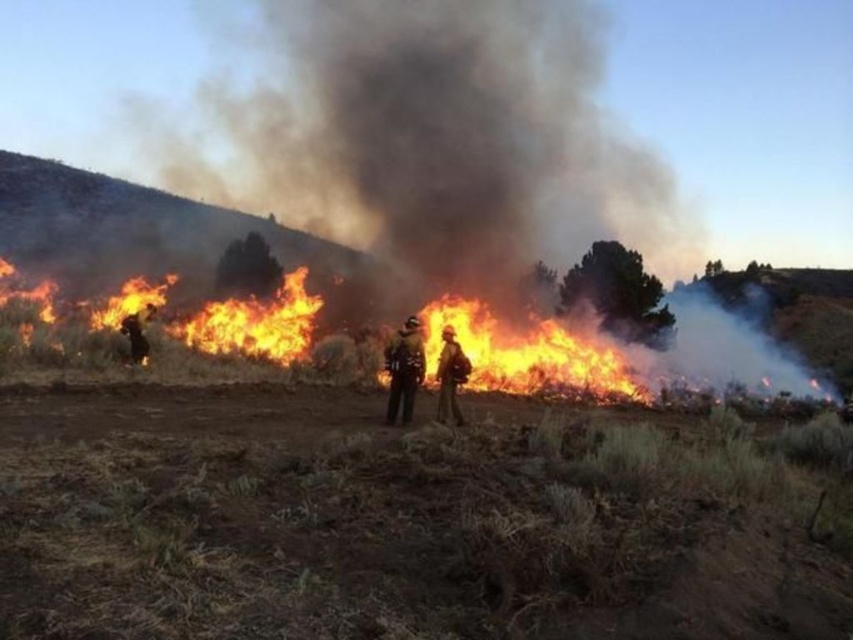
Can you confirm if black smoke at center is smaller than dark brown uniform at left?

Incorrect, black smoke at center is not smaller in size than dark brown uniform at left.

Does black smoke at center appear on the right side of dark brown uniform at left?

Correct, you'll find black smoke at center to the right of dark brown uniform at left.

The image size is (853, 640). In order to click on black smoke at center in this screenshot , I will do `click(520, 129)`.

The image size is (853, 640). I want to click on reflective silver helmet at center, so click(404, 369).

Can you confirm if reflective silver helmet at center is positioned to the left of dark brown uniform at left?

No, reflective silver helmet at center is not to the left of dark brown uniform at left.

Who is more forward, (399,333) or (132,358)?

→ Positioned in front is point (399,333).

Find the location of `reflective silver helmet at center`. reflective silver helmet at center is located at coordinates (404, 369).

Who is more forward, (685, 305) or (444, 400)?

Point (444, 400)

Is bright orange flames at center thinner than orange flame helmet at center?

No, bright orange flames at center is not thinner than orange flame helmet at center.

Which is in front, point (370, 355) or point (450, 408)?

Point (450, 408) is in front.

You are a GUI agent. You are given a task and a screenshot of the screen. Output one action in this format:
    pyautogui.click(x=<x>, y=<y>)
    Task: Click on the bright orange flames at center
    
    Given the screenshot: What is the action you would take?
    pyautogui.click(x=618, y=353)